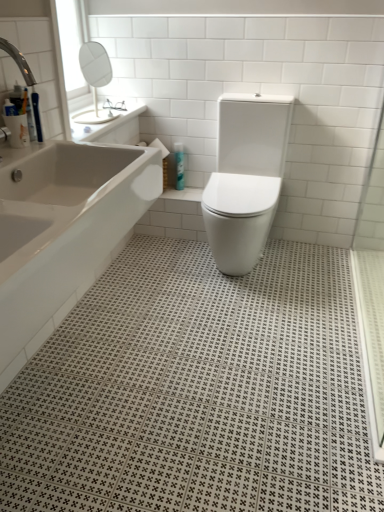
At what (x,y) coordinates should I click in order to perform the action: click on white glossy bathtub at left. Please return your answer as a coordinate pair (x, y). Image resolution: width=384 pixels, height=512 pixels. Looking at the image, I should click on (62, 231).

The height and width of the screenshot is (512, 384). Identify the location of blue glossy bottle at center. (179, 165).

Where is `white glossy toilet at center`? This screenshot has width=384, height=512. white glossy toilet at center is located at coordinates (245, 178).

The width and height of the screenshot is (384, 512). I want to click on white glossy bathtub at left, so click(x=62, y=231).

Who is shorter, white glossy bathtub at left or white glossy toilet at center?

With less height is white glossy bathtub at left.

You are a GUI agent. You are given a task and a screenshot of the screen. Output one action in this format:
    pyautogui.click(x=<x>, y=<y>)
    Task: Click on the toilet that appears above the white glossy bathtub at left (from the image's perspective)
    This screenshot has height=512, width=384.
    Given the screenshot: What is the action you would take?
    pyautogui.click(x=245, y=178)

What's the angular difference between white glossy bathtub at left and white glossy toilet at center's facing directions?

They differ by 91.8 degrees in their facing directions.

Is white glossy bathtub at left wider than white glossy toilet at center?

No.

Find the location of a particular element. This screenshot has width=384, height=512. bathtub below the white glossy toilet at center (from the image's perspective) is located at coordinates (62, 231).

Which is more to the left, white glossy toilet at center or white glossy bathtub at left?

white glossy bathtub at left is more to the left.

Measure the distance from white glossy toilet at center to white glossy bathtub at left.

white glossy toilet at center and white glossy bathtub at left are 34.73 inches apart.

Is white glossy bathtub at left completely or partially inside white glossy toilet at center?

No, white glossy bathtub at left is located outside of white glossy toilet at center.

Could white glossy toilet at center be considered to be inside blue glossy bottle at center?

No, white glossy toilet at center is not inside blue glossy bottle at center.

Is blue glossy bottle at center not near white glossy toilet at center?

Actually, blue glossy bottle at center and white glossy toilet at center are a little close together.

From the image's perspective, does blue glossy bottle at center appear higher than white glossy toilet at center?

Correct, blue glossy bottle at center appears higher than white glossy toilet at center in the image.

Considering the relative sizes of blue glossy bottle at center and white glossy toilet at center in the image provided, is blue glossy bottle at center bigger than white glossy toilet at center?

No, blue glossy bottle at center is not bigger than white glossy toilet at center.

Does blue glossy bottle at center have a greater width compared to white glossy bathtub at left?

In fact, blue glossy bottle at center might be narrower than white glossy bathtub at left.

Would you say blue glossy bottle at center is inside or outside white glossy bathtub at left?

blue glossy bottle at center is outside white glossy bathtub at left.

From the image's perspective, who appears lower, blue glossy bottle at center or white glossy bathtub at left?

white glossy bathtub at left appears lower in the image.

Would you say white glossy bathtub at left is a long distance from blue glossy bottle at center?

white glossy bathtub at left is far away from blue glossy bottle at center.

Does white glossy bathtub at left have a lesser width compared to blue glossy bottle at center?

In fact, white glossy bathtub at left might be wider than blue glossy bottle at center.

Does white glossy bathtub at left appear on the right side of blue glossy bottle at center?

No.

In the scene shown: What's the angular difference between white glossy toilet at center and blue glossy bottle at center's facing directions?

They differ by 4.1 degrees in their facing directions.

From the image's perspective, between white glossy toilet at center and blue glossy bottle at center, who is located below?

white glossy toilet at center is shown below in the image.

Is white glossy toilet at center inside or outside of blue glossy bottle at center?

white glossy toilet at center is outside blue glossy bottle at center.

Considering the relative sizes of white glossy toilet at center and blue glossy bottle at center in the image provided, is white glossy toilet at center bigger than blue glossy bottle at center?

Yes, white glossy toilet at center is bigger than blue glossy bottle at center.

In order to click on bathtub above the white glossy toilet at center (from a real-world perspective) in this screenshot , I will do `click(62, 231)`.

Identify the location of toilet that is under the white glossy bathtub at left (from a real-world perspective). (245, 178).

From the image, which object appears to be nearer to blue glossy bottle at center, white glossy toilet at center or white glossy bathtub at left?

white glossy toilet at center is positioned closer to the anchor blue glossy bottle at center.

Looking at the image, which one is located closer to white glossy toilet at center, white glossy bathtub at left or blue glossy bottle at center?

blue glossy bottle at center lies closer to white glossy toilet at center than the other object.

From the image, which object appears to be farther from white glossy toilet at center, blue glossy bottle at center or white glossy bathtub at left?

Among the two, white glossy bathtub at left is located further to white glossy toilet at center.

Estimate the real-world distances between objects in this image. Which object is further from blue glossy bottle at center, white glossy bathtub at left or white glossy toilet at center?

white glossy bathtub at left is further to blue glossy bottle at center.

Based on their spatial positions, is blue glossy bottle at center or white glossy toilet at center further from white glossy bathtub at left?

blue glossy bottle at center is further to white glossy bathtub at left.

Considering their positions, is white glossy toilet at center positioned further to white glossy bathtub at left than blue glossy bottle at center?

blue glossy bottle at center.

Image resolution: width=384 pixels, height=512 pixels. What are the coordinates of `toilet between white glossy bathtub at left and blue glossy bottle at center from front to back` in the screenshot? It's located at (245, 178).